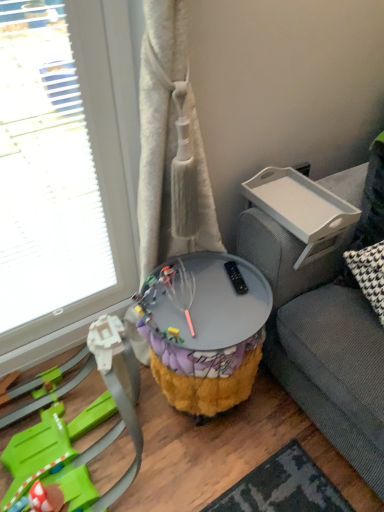
You are a GUI agent. You are given a task and a screenshot of the screen. Output one action in this format:
    pyautogui.click(x=<x>, y=<y>)
    Task: Click on the space that is in front of fuzzy fabric side table at center, acting as the 2th table starting from the top
    The image size is (384, 512).
    Given the screenshot: What is the action you would take?
    pyautogui.click(x=251, y=469)